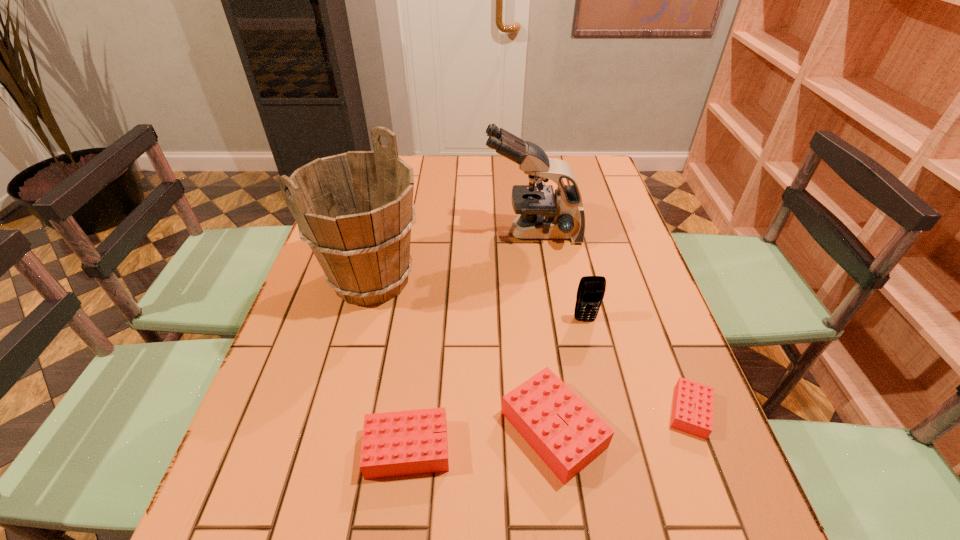
The image size is (960, 540). What are the coordinates of `the fifth tallest object` in the screenshot? It's located at (401, 443).

Locate an element on the screen. the leftmost Lego is located at coordinates (401, 443).

The height and width of the screenshot is (540, 960). What are the coordinates of `the second Lego from left to right` in the screenshot? It's located at (567, 434).

You are a GUI agent. You are given a task and a screenshot of the screen. Output one action in this format:
    pyautogui.click(x=<x>, y=<y>)
    Task: Click on the shortest object
    The width and height of the screenshot is (960, 540).
    Given the screenshot: What is the action you would take?
    pyautogui.click(x=693, y=403)

The width and height of the screenshot is (960, 540). What are the coordinates of `the rightmost object` in the screenshot? It's located at (693, 403).

Where is `microscope`? The height and width of the screenshot is (540, 960). microscope is located at coordinates (544, 214).

You are a GUI agent. You are given a task and a screenshot of the screen. Output one action in this format:
    pyautogui.click(x=<x>, y=<y>)
    Task: Click on the bucket
    Image resolution: width=960 pixels, height=540 pixels.
    Given the screenshot: What is the action you would take?
    pyautogui.click(x=355, y=210)

Find the location of a particular element. cellular telephone is located at coordinates pyautogui.click(x=591, y=289).

I want to click on free location located on the right of the second shortest Lego, so click(x=541, y=449).

Find the location of a particular element. free space located 0.050m on the right of the second Lego from right to left is located at coordinates (631, 430).